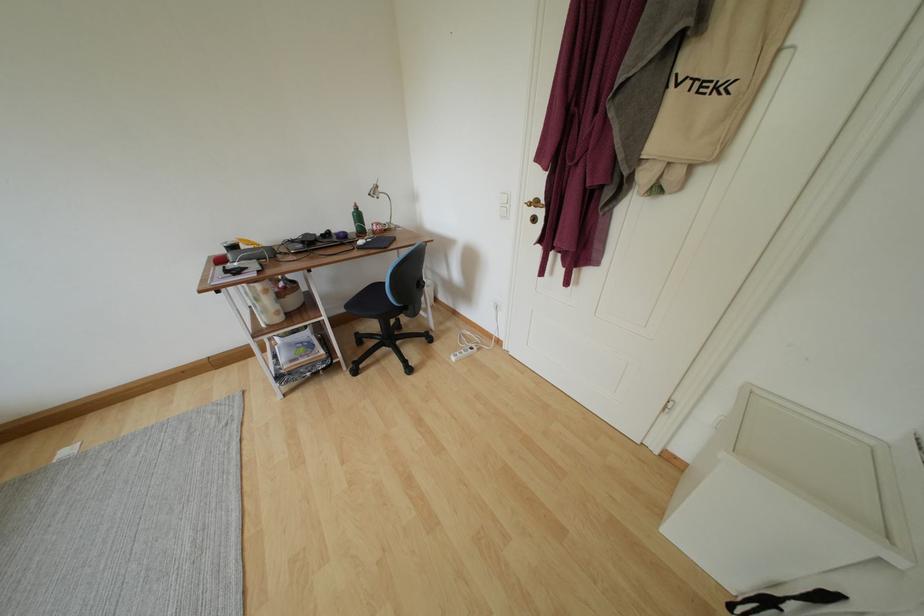
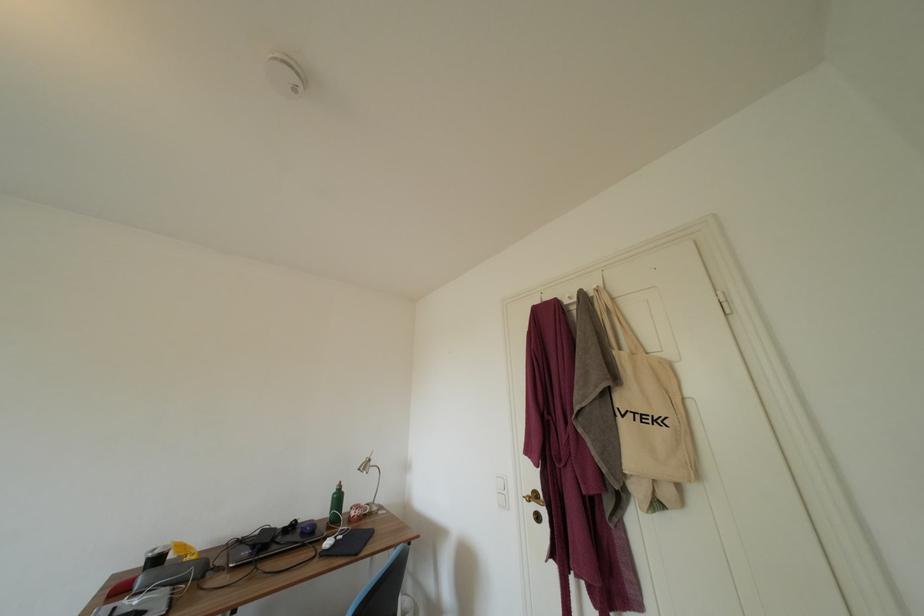
Question: The images are taken continuously from a first-person perspective. In which direction is your viewpoint rotating?

Choices:
 (A) Left
 (B) Right
 (C) Up
 (D) Down

Answer: (C)